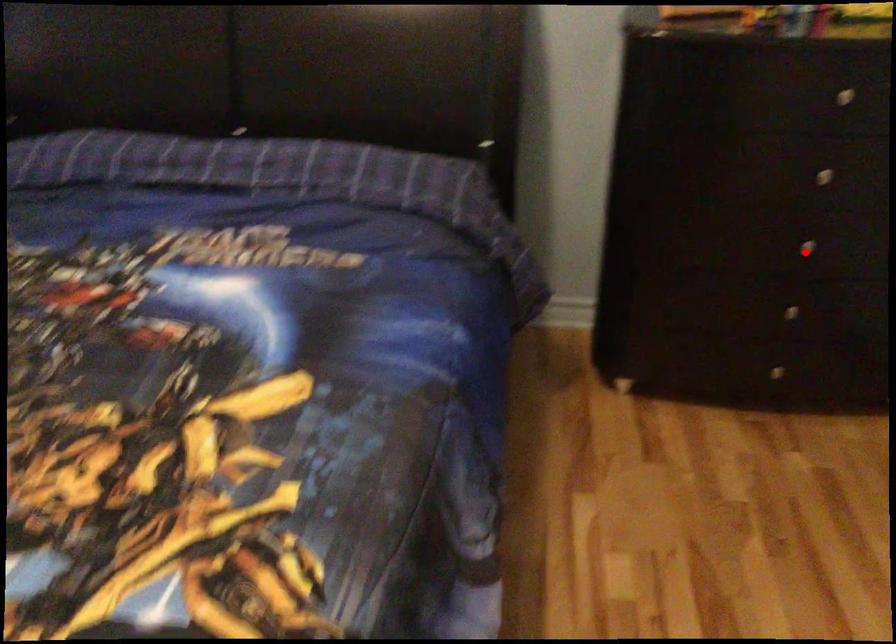
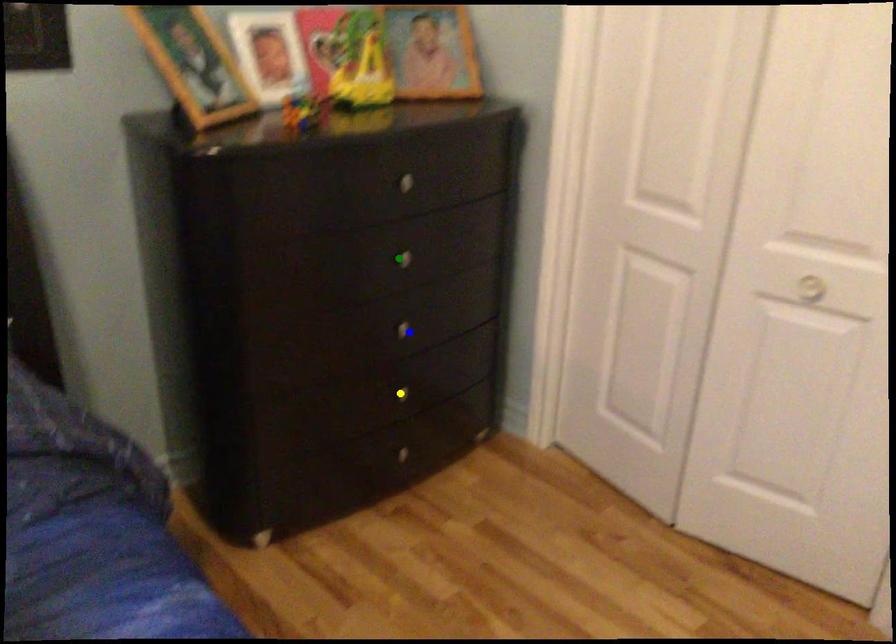
Question: I am providing you with two images of the same scene from different viewpoints. A red point is marked on the first image. You are given multiple points on the second image. In image 2, which mark is for the same physical point as the one in image 1?

Choices:
 (A) yellow point
 (B) blue point
 (C) green point

Answer: (B)